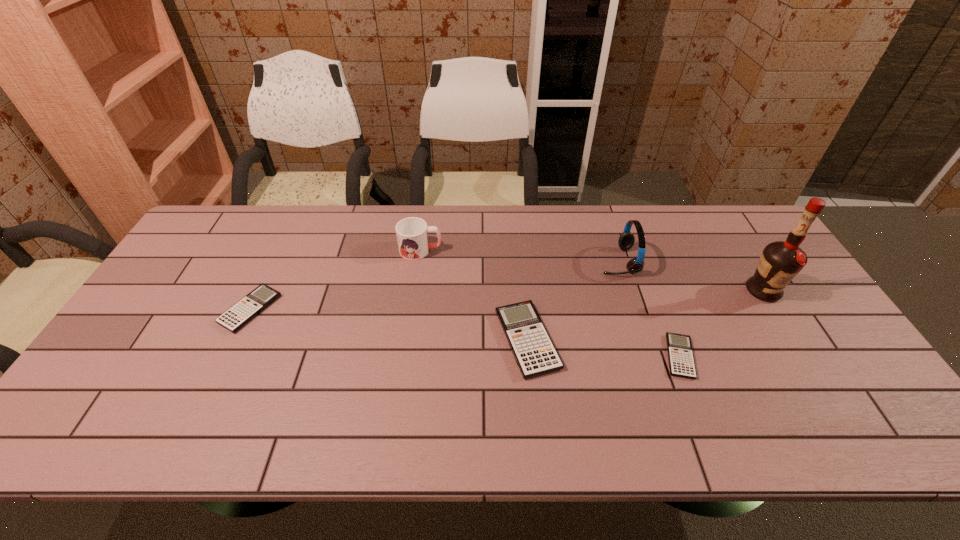
You are a GUI agent. You are given a task and a screenshot of the screen. Output one action in this format:
    pyautogui.click(x=<x>, y=<y>)
    Task: Click on the fifth shortest object
    Image resolution: width=960 pixels, height=540 pixels.
    Given the screenshot: What is the action you would take?
    pyautogui.click(x=626, y=240)

The image size is (960, 540). I want to click on vacant region located on the right of the leftmost object, so click(301, 309).

Identify the location of vacant point located on the right of the third object from left to right. [x=588, y=340].

Find the location of `free point located 0.190m on the right of the rightmost calculator`. free point located 0.190m on the right of the rightmost calculator is located at coordinates point(771,356).

This screenshot has height=540, width=960. In order to click on free space located on the side of the mug with the handle in this screenshot , I will do `click(566, 250)`.

Locate an element on the screen. The image size is (960, 540). vacant space located 0.160m on the front and back of the liquor is located at coordinates (800, 350).

Identify the location of blank area located with the microphone attached to the side of the second tallest object. (568, 261).

This screenshot has height=540, width=960. Find the location of `free location located with the microphone attached to the side of the second tallest object`. free location located with the microphone attached to the side of the second tallest object is located at coordinates (555, 261).

The width and height of the screenshot is (960, 540). I want to click on vacant area situated with the microphone attached to the side of the second tallest object, so click(549, 261).

You are a GUI agent. You are given a task and a screenshot of the screen. Output one action in this format:
    pyautogui.click(x=<x>, y=<y>)
    Task: Click on the mug located at the far edge
    
    Given the screenshot: What is the action you would take?
    point(412,233)